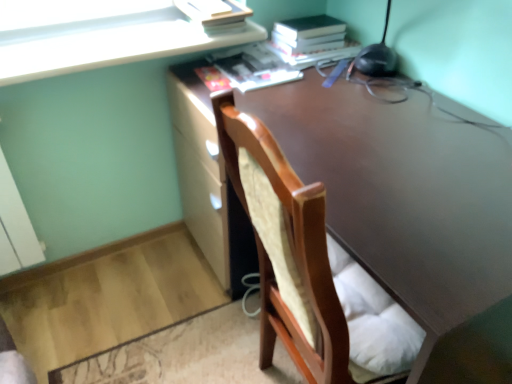
The image size is (512, 384). What are the coordinates of `unoccupied region to the right of matte paper book at upper center` in the screenshot? It's located at (330, 85).